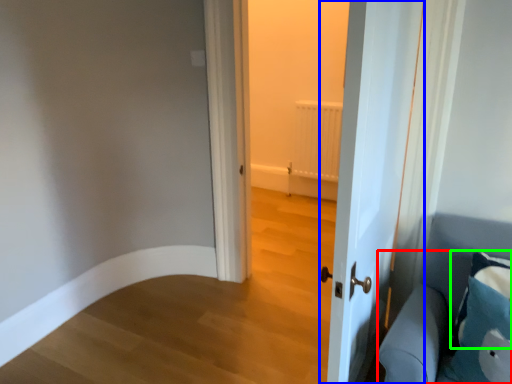
Question: Estimate the real-world distances between objects in this image. Which object is closer to furniture (highlighted by a red box), door (highlighted by a blue box) or pillow (highlighted by a green box)?

Choices:
 (A) door
 (B) pillow

Answer: (B)